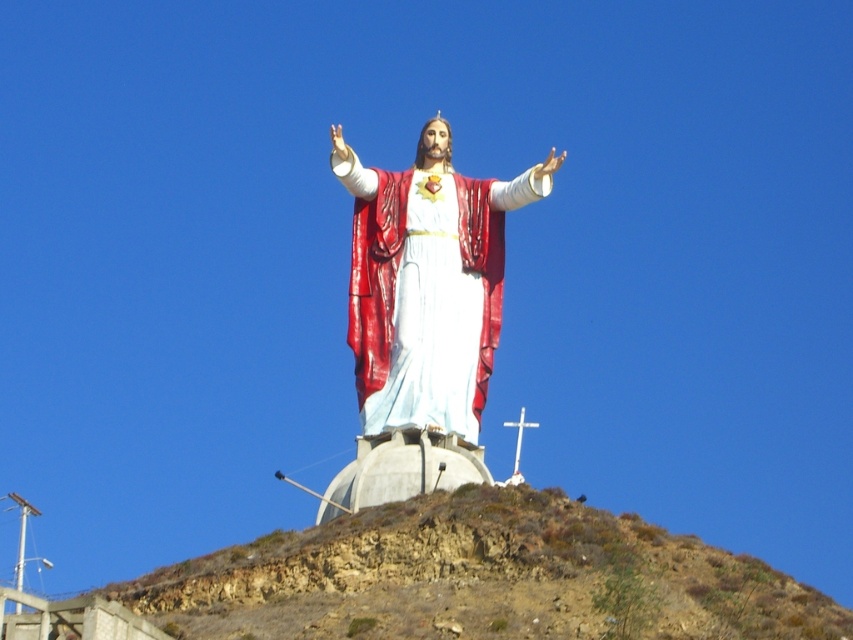
You are a tourist visiting the statue and want to take a photo of the shiny red fabric at center and the brown rocky hillside at center. Which object should you focus on first if you want to capture both in one frame without moving your camera?

You should focus on the shiny red fabric at center first because the brown rocky hillside at center is to the right of it, so adjusting the camera to include both would require framing from the left side where the fabric is positioned.